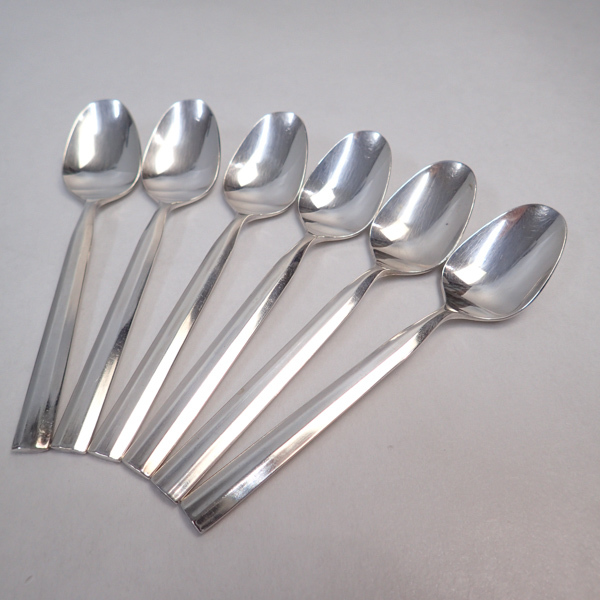
The width and height of the screenshot is (600, 600). I want to click on spoons, so [122, 156], [190, 162], [273, 169], [341, 185], [405, 210], [497, 273].